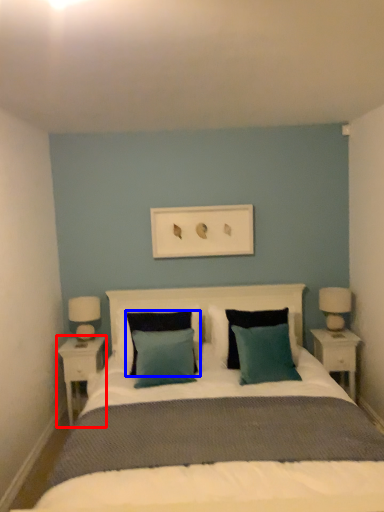
Question: Which of the following is the closest to the observer, nightstand (highlighted by a red box) or pillow (highlighted by a blue box)?

Choices:
 (A) nightstand
 (B) pillow

Answer: (B)